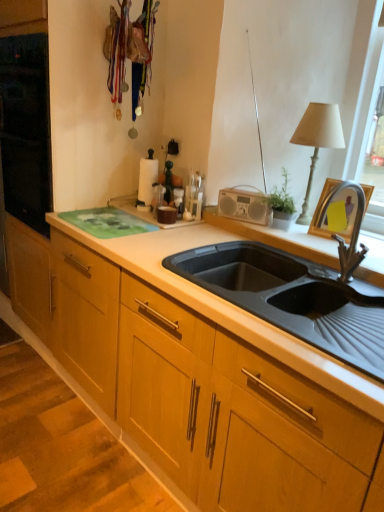
Question: Does black rubber sink at center lie in front of white paper towel holder at upper center?

Choices:
 (A) yes
 (B) no

Answer: (A)

Question: Does black rubber sink at center have a greater height compared to white paper towel holder at upper center?

Choices:
 (A) yes
 (B) no

Answer: (B)

Question: Does black rubber sink at center come behind white paper towel holder at upper center?

Choices:
 (A) yes
 (B) no

Answer: (B)

Question: Would you say black rubber sink at center is a long distance from white paper towel holder at upper center?

Choices:
 (A) no
 (B) yes

Answer: (A)

Question: From the image's perspective, does black rubber sink at center appear lower than white paper towel holder at upper center?

Choices:
 (A) yes
 (B) no

Answer: (A)

Question: From a real-world perspective, is black rubber sink at center beneath white paper towel holder at upper center?

Choices:
 (A) no
 (B) yes

Answer: (B)

Question: From the image's perspective, is white fabric lampshade at upper right on top of black rubber sink at center?

Choices:
 (A) no
 (B) yes

Answer: (B)

Question: Does white fabric lampshade at upper right have a lesser height compared to black rubber sink at center?

Choices:
 (A) yes
 (B) no

Answer: (B)

Question: Is black rubber sink at center a part of white fabric lampshade at upper right?

Choices:
 (A) yes
 (B) no

Answer: (B)

Question: Is black rubber sink at center at the back of white fabric lampshade at upper right?

Choices:
 (A) yes
 (B) no

Answer: (B)

Question: Is white fabric lampshade at upper right located outside black rubber sink at center?

Choices:
 (A) yes
 (B) no

Answer: (A)

Question: Does white fabric lampshade at upper right appear on the right side of black rubber sink at center?

Choices:
 (A) yes
 (B) no

Answer: (A)

Question: Considering the relative sizes of white paper towel holder at upper center and black rubber sink at center in the image provided, is white paper towel holder at upper center taller than black rubber sink at center?

Choices:
 (A) no
 (B) yes

Answer: (B)